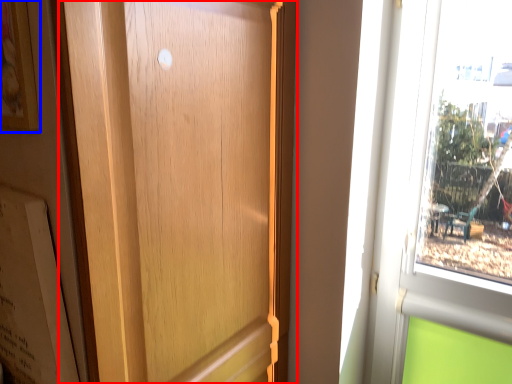
Question: Which point is closer to the camera, door (highlighted by a red box) or picture frame (highlighted by a blue box)?

Choices:
 (A) door
 (B) picture frame

Answer: (A)